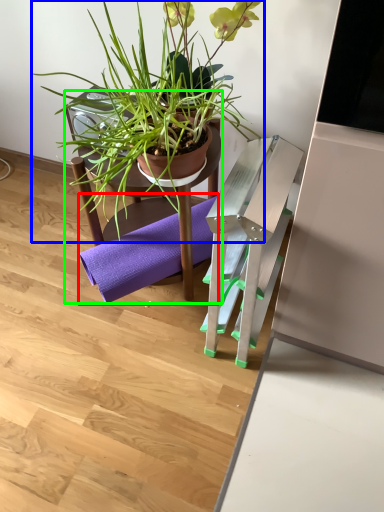
Question: Which is farther away from yoga mat (highlighted by a red box)? houseplant (highlighted by a blue box) or chair (highlighted by a green box)?

Choices:
 (A) houseplant
 (B) chair

Answer: (A)